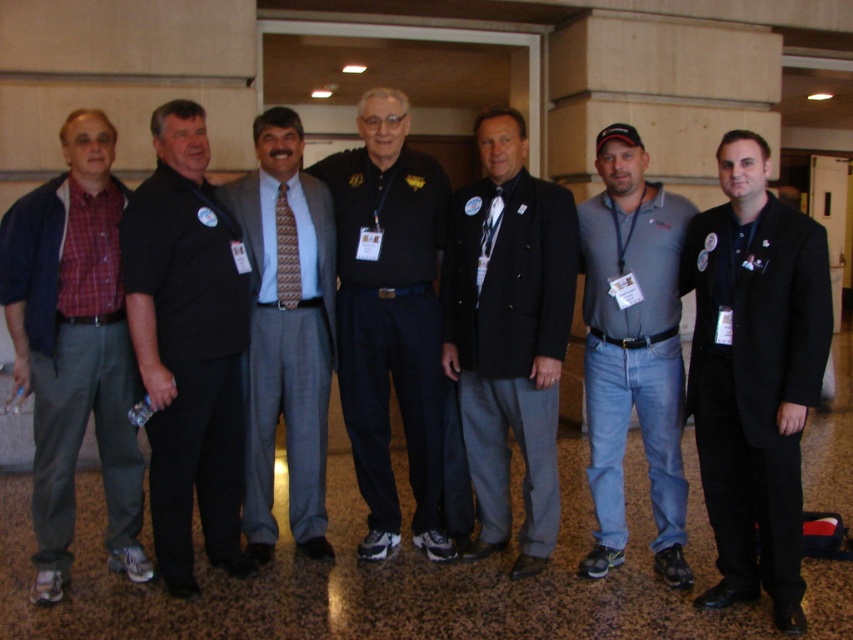
What is the color of the clothing worn by the person located at the coordinates point (390, 317)?

The point (390, 317) corresponds to the black cotton polo shirt at center, so the color is black.

You are organizing a photo shoot and need to ensure that the black wool coat at center and the light blue textured pants at center are positioned in a way that their widths are clearly visible. Based on the scene description, which item should be placed to the side to emphasize its width difference?

The black wool coat at center has a lesser width compared to the light blue textured pants at center. To emphasize their width difference, the black wool coat at center should be placed to one side so that its narrower width contrasts with the wider light blue textured pants at center.